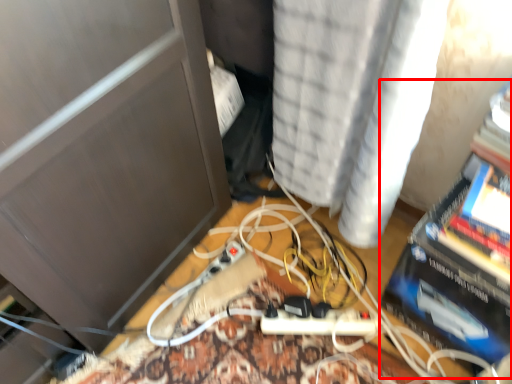
Question: From the image's perspective, what is the correct spatial relationship of paperback book (annotated by the red box) in relation to curtain?

Choices:
 (A) above
 (B) below

Answer: (B)